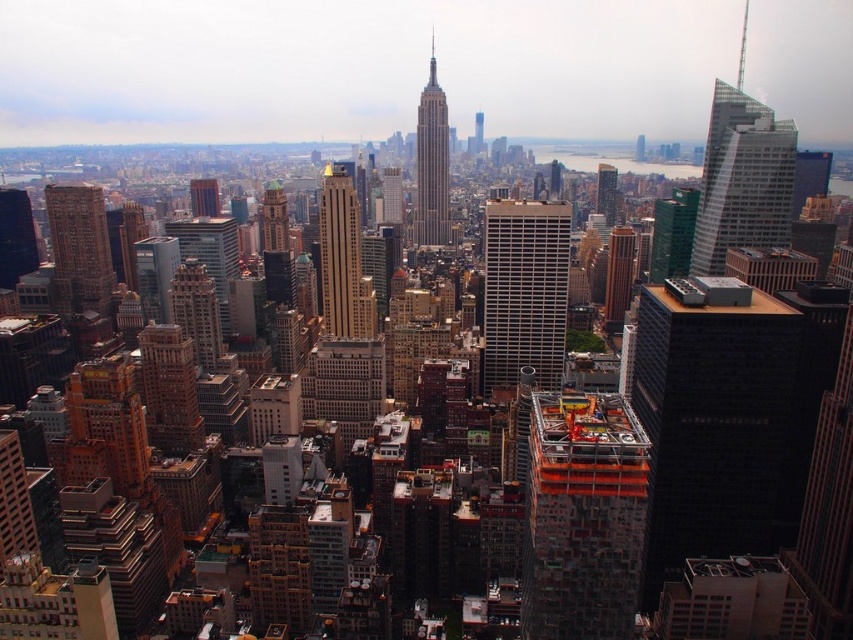
Question: Which is nearer to the orange mesh construction at center-right?

Choices:
 (A) gray stone tower at center
 (B) glassy reflective skyscraper at center-right
 (C) gold-brick building at center
 (D) brown brick building at left

Answer: (C)

Question: Which point is farther to the camera?

Choices:
 (A) (56, 209)
 (B) (550, 464)

Answer: (A)

Question: Is the position of orange mesh construction at center-right less distant than that of brown brick building at center-left?

Choices:
 (A) no
 (B) yes

Answer: (B)

Question: In this image, where is brown brick building at left located relative to gray stone tower at center?

Choices:
 (A) left
 (B) right

Answer: (A)

Question: Which is nearer to the gray stone tower at center?

Choices:
 (A) green glass building at upper right
 (B) smooth glass skyscraper at center
 (C) brown brick building at center-left

Answer: (B)

Question: Can you confirm if orange mesh construction at center-right is wider than glassy reflective skyscraper at upper right?

Choices:
 (A) yes
 (B) no

Answer: (B)